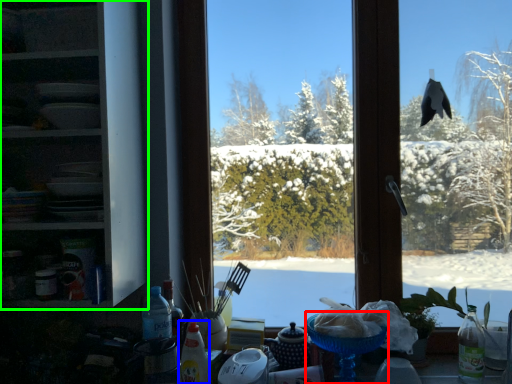
Question: Estimate the real-world distances between objects in this image. Which object is closer to tableware (highlighted by a red box), bottle (highlighted by a blue box) or shelf (highlighted by a green box)?

Choices:
 (A) bottle
 (B) shelf

Answer: (A)